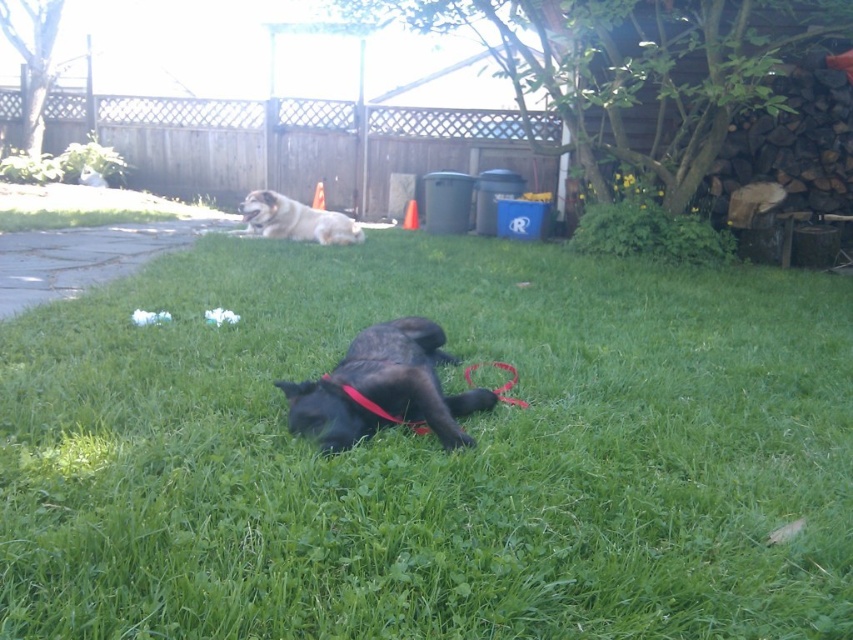
Can you confirm if shiny black dog at center is positioned to the left of fuzzy brown dog at upper center?

Incorrect, shiny black dog at center is not on the left side of fuzzy brown dog at upper center.

Consider the image. Is the position of shiny black dog at center less distant than that of fuzzy brown dog at upper center?

Yes, it is.

Between point (363, 364) and point (288, 196), which one is positioned behind?

Point (288, 196)

The width and height of the screenshot is (853, 640). What are the coordinates of `shiny black dog at center` in the screenshot? It's located at (383, 388).

Is green grass at center behind shiny black dog at center?

No, it is in front of shiny black dog at center.

Between green grass at center and shiny black dog at center, which one appears on the right side from the viewer's perspective?

green grass at center

Is point (503, 582) farther from viewer compared to point (343, 419)?

No, (503, 582) is closer to viewer.

Locate an element on the screen. This screenshot has height=640, width=853. green grass at center is located at coordinates (431, 452).

Is green grass at center positioned behind fuzzy brown dog at upper center?

No, it is in front of fuzzy brown dog at upper center.

The height and width of the screenshot is (640, 853). What do you see at coordinates (431, 452) in the screenshot? I see `green grass at center` at bounding box center [431, 452].

Identify the location of green grass at center. The height and width of the screenshot is (640, 853). (431, 452).